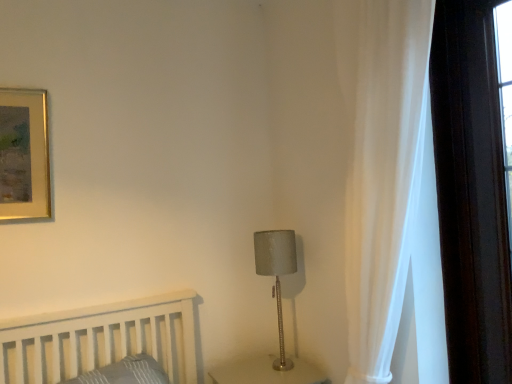
Image resolution: width=512 pixels, height=384 pixels. What do you see at coordinates (276, 274) in the screenshot?
I see `satin gray lampshade at center-right` at bounding box center [276, 274].

Image resolution: width=512 pixels, height=384 pixels. I want to click on satin gray lampshade at center-right, so click(276, 274).

The height and width of the screenshot is (384, 512). I want to click on white sheer curtain at right, so click(384, 177).

This screenshot has height=384, width=512. What do you see at coordinates (384, 177) in the screenshot? I see `white sheer curtain at right` at bounding box center [384, 177].

At what (x,y) coordinates should I click in order to perform the action: click on satin gray lampshade at center-right. Please return your answer as a coordinate pair (x, y). The height and width of the screenshot is (384, 512). Looking at the image, I should click on (276, 274).

Does white sheer curtain at right appear on the left side of satin gray lampshade at center-right?

In fact, white sheer curtain at right is to the right of satin gray lampshade at center-right.

Considering the positions of objects white sheer curtain at right and satin gray lampshade at center-right in the image provided, who is in front, white sheer curtain at right or satin gray lampshade at center-right?

white sheer curtain at right.

Considering the points (408, 58) and (272, 253), which point is behind, point (408, 58) or point (272, 253)?

The point (272, 253) is more distant.

From the image's perspective, does white sheer curtain at right appear higher than satin gray lampshade at center-right?

Yes.

From a real-world perspective, is white sheer curtain at right on satin gray lampshade at center-right?

Indeed, from a real-world perspective, white sheer curtain at right stands above satin gray lampshade at center-right.

Is white sheer curtain at right wider than satin gray lampshade at center-right?

Yes.

From the picture: From their relative heights in the image, would you say white sheer curtain at right is taller or shorter than satin gray lampshade at center-right?

white sheer curtain at right is taller than satin gray lampshade at center-right.

Which of these two, white sheer curtain at right or satin gray lampshade at center-right, is bigger?

white sheer curtain at right is bigger.

Would you say white sheer curtain at right is outside satin gray lampshade at center-right?

white sheer curtain at right lies outside satin gray lampshade at center-right's area.

Is white sheer curtain at right next to satin gray lampshade at center-right and touching it?

No, white sheer curtain at right is not next to satin gray lampshade at center-right.

Consider the image. Is white sheer curtain at right turned away from satin gray lampshade at center-right?

No, white sheer curtain at right is not facing the opposite direction of satin gray lampshade at center-right.

From the picture: Can you tell me how much white sheer curtain at right and satin gray lampshade at center-right differ in facing direction?

white sheer curtain at right and satin gray lampshade at center-right are facing 89.1 degrees away from each other.

What are the coordinates of `curtain in front of the satin gray lampshade at center-right` in the screenshot? It's located at (384, 177).

Considering the relative positions of satin gray lampshade at center-right and white sheer curtain at right in the image provided, is satin gray lampshade at center-right to the left of white sheer curtain at right from the viewer's perspective?

Indeed, satin gray lampshade at center-right is positioned on the left side of white sheer curtain at right.

Is the position of satin gray lampshade at center-right less distant than that of white sheer curtain at right?

No, satin gray lampshade at center-right is further to the viewer.

Which is closer, (261,246) or (412,24)?

The point (412,24) is closer.

From the image's perspective, who appears lower, satin gray lampshade at center-right or white sheer curtain at right?

satin gray lampshade at center-right, from the image's perspective.

From a real-world perspective, relative to white sheer curtain at right, is satin gray lampshade at center-right vertically above or below?

Clearly, from a real-world perspective, satin gray lampshade at center-right is below white sheer curtain at right.

Between satin gray lampshade at center-right and white sheer curtain at right, which one has larger width?

Wider between the two is white sheer curtain at right.

Who is shorter, satin gray lampshade at center-right or white sheer curtain at right?

Standing shorter between the two is satin gray lampshade at center-right.

Can you confirm if satin gray lampshade at center-right is smaller than white sheer curtain at right?

Correct, satin gray lampshade at center-right occupies less space than white sheer curtain at right.

Do you think satin gray lampshade at center-right is within white sheer curtain at right, or outside of it?

satin gray lampshade at center-right is not inside white sheer curtain at right, it's outside.

Is satin gray lampshade at center-right not near white sheer curtain at right?

No, satin gray lampshade at center-right is in close proximity to white sheer curtain at right.

Is satin gray lampshade at center-right looking in the opposite direction of white sheer curtain at right?

No, satin gray lampshade at center-right is not facing away from white sheer curtain at right.

Locate an element on the screen. Image resolution: width=512 pixels, height=384 pixels. curtain on the right of satin gray lampshade at center-right is located at coordinates (384, 177).

At what (x,y) coordinates should I click in order to perform the action: click on table lamp beneath the white sheer curtain at right (from a real-world perspective). Please return your answer as a coordinate pair (x, y). The image size is (512, 384). Looking at the image, I should click on (276, 274).

Locate an element on the screen. This screenshot has width=512, height=384. table lamp on the left of white sheer curtain at right is located at coordinates (276, 274).